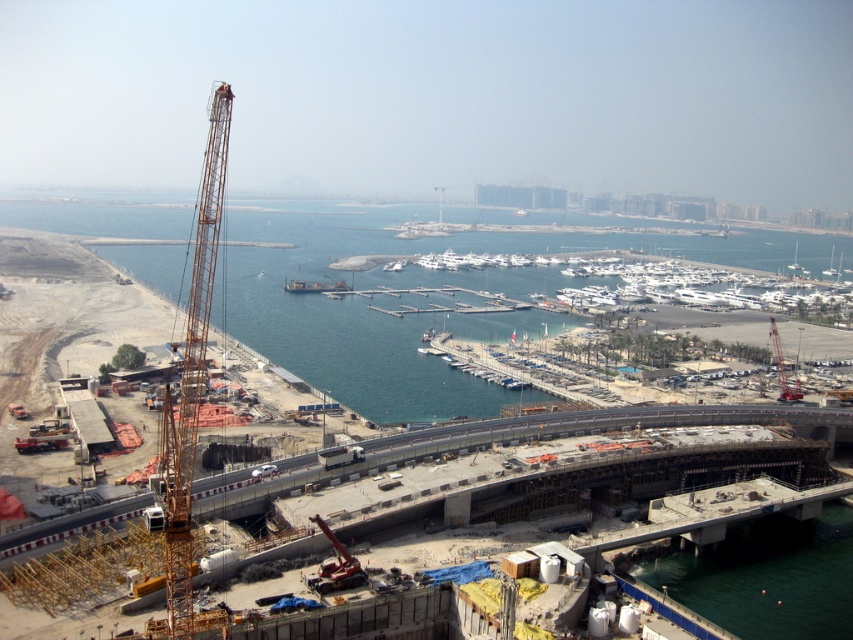
You are standing at the construction site and want to move from point A to point B. Point A is at coordinates point [700,394] and point B is at coordinates point [177,564]. Since you are facing the crane, which direction should you walk to get closer to point B?

Since point [700,394] is further to the viewer than point [177,564], you should walk forward towards the crane to get closer to point B.

You are a construction worker standing on the scaffolding near the orange construction crane at left and the yellow metallic crane at left. Which crane is closer to you?

The orange construction crane at left is closer to you because it is further to the viewer than the yellow metallic crane at left, meaning it appears nearer in the image.